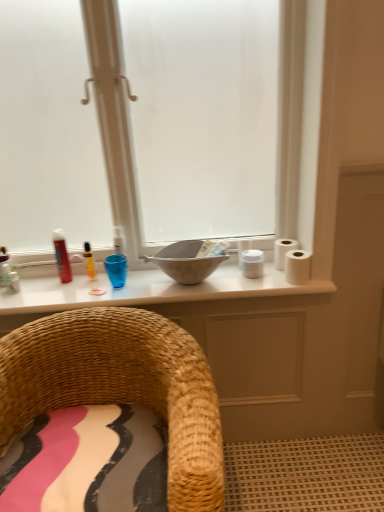
Identify the location of vacant location below matte glass window at center (from a real-world perspective). The width and height of the screenshot is (384, 512). (110, 289).